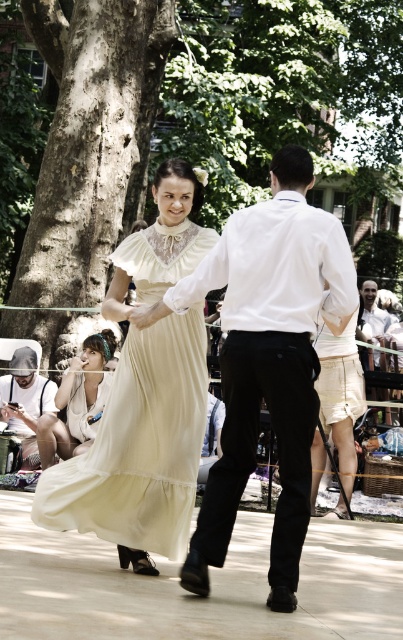
Can you confirm if matte cream dress at center is shorter than denim cap at left?

No, matte cream dress at center is not shorter than denim cap at left.

Does matte cream dress at center lie in front of denim cap at left?

Yes, matte cream dress at center is in front of denim cap at left.

Which is behind, point (159, 321) or point (0, 404)?

The point (0, 404) is more distant.

This screenshot has height=640, width=403. In order to click on matte cream dress at center in this screenshot , I will do point(139,445).

Between point (315, 224) and point (149, 269), which one is positioned in front?

Point (315, 224) is more forward.

Does point (301, 365) lie behind point (164, 492)?

That is False.

Which is behind, point (265, 292) or point (151, 228)?

The point (151, 228) is behind.

The height and width of the screenshot is (640, 403). In order to click on white cotton shirt at center in this screenshot , I will do `click(265, 358)`.

Does white lace dress at lower left have a lesser width compared to denim cap at left?

In fact, white lace dress at lower left might be wider than denim cap at left.

Who is more distant from viewer, [68,368] or [29,378]?

Point [68,368]

Image resolution: width=403 pixels, height=640 pixels. In order to click on white lace dress at lower left in this screenshot , I will do `click(78, 401)`.

Find the location of a particular element. white lace dress at lower left is located at coordinates (78, 401).